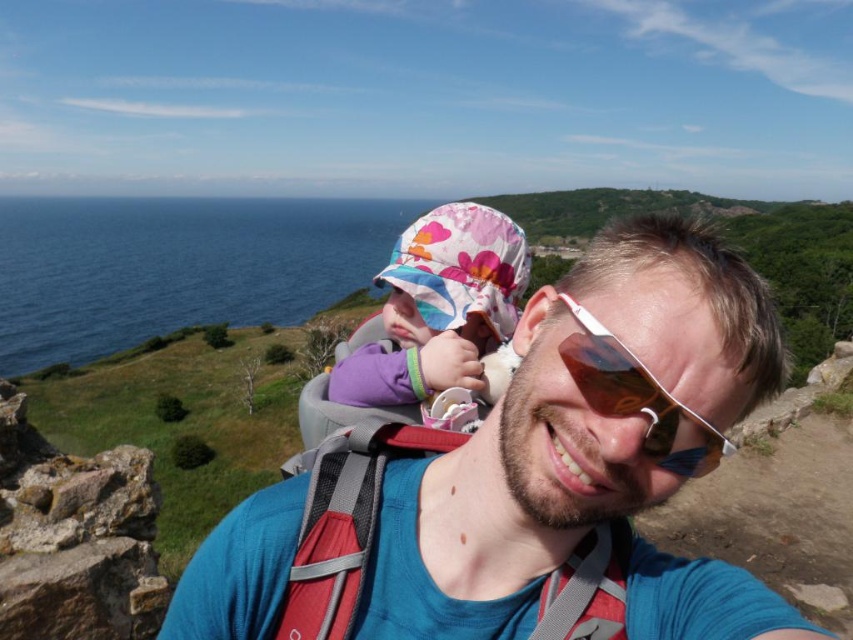
Question: Does floral fabric hat at center have a larger size compared to sunglasses at center?

Choices:
 (A) no
 (B) yes

Answer: (B)

Question: Which of the following is the closest to the observer?

Choices:
 (A) brown stone cliff at lower left
 (B) sunglasses at center
 (C) blue fabric shirt at center

Answer: (B)

Question: Which point appears closest to the camera in this image?

Choices:
 (A) tap(142, 637)
 (B) tap(662, 410)

Answer: (B)

Question: In this image, where is blue fabric shirt at center located relative to sunglasses at center?

Choices:
 (A) above
 (B) below

Answer: (A)

Question: Where is brown stone cliff at lower left located in relation to sunglasses at center in the image?

Choices:
 (A) below
 (B) above

Answer: (A)

Question: Estimate the real-world distances between objects in this image. Which object is farther from the sunglasses at center?

Choices:
 (A) brown stone cliff at lower left
 (B) floral fabric hat at center
 (C) blue fabric shirt at center

Answer: (A)